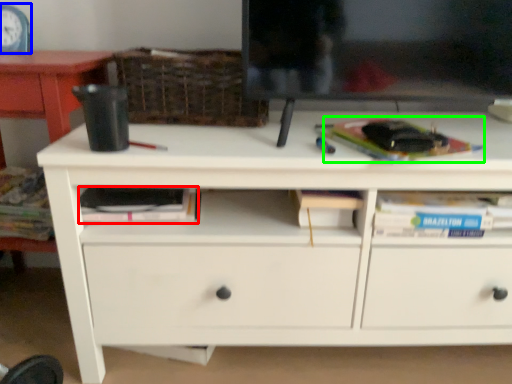
Question: Based on their relative distances, which object is farther from paperback book (highlighted by a red box)? Choose from clock (highlighted by a blue box) and paperback book (highlighted by a green box).

Choices:
 (A) clock
 (B) paperback book

Answer: (A)